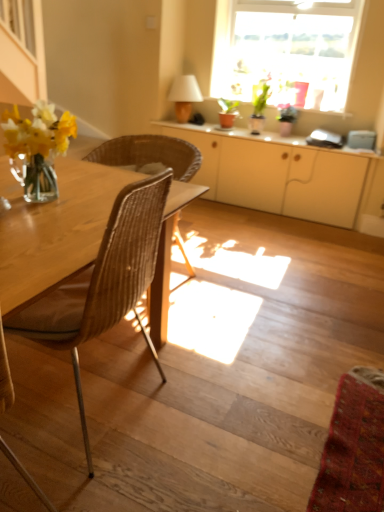
Identify the location of vacant area that lies to the right of brown woven chair at left. This screenshot has width=384, height=512. coord(225,411).